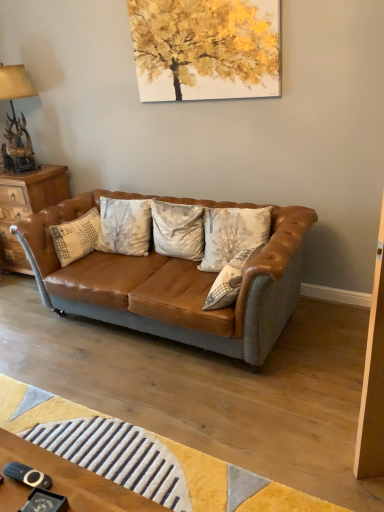
Question: Is point (216, 282) closer or farther from the camera than point (97, 237)?

Choices:
 (A) closer
 (B) farther

Answer: (A)

Question: From a real-world perspective, relative to white textured pillow at center, positioned as the 4th pillow in right-to-left order, is textured beige pillow at center, which is counted as the third pillow, starting from the left, vertically above or below?

Choices:
 (A) below
 (B) above

Answer: (A)

Question: Which object is positioned closest to the yellow woolen mat at lower center?

Choices:
 (A) textured beige pillow at center, the first pillow positioned from the right
 (B) textured beige pillow at center, the 2th pillow in the right-to-left sequence
 (C) leather couch at center
 (D) silky beige pillow at center, the third pillow when ordered from right to left
 (E) antler bronze lamp at upper left

Answer: (C)

Question: Which object is positioned closest to the textured beige pillow at center, marked as the 4th pillow in a left-to-right arrangement?

Choices:
 (A) antler bronze lamp at upper left
 (B) silky beige pillow at center, the third pillow when ordered from right to left
 (C) textured beige pillow at center, which is counted as the third pillow, starting from the left
 (D) white textured pillow at center, the first pillow when ordered from left to right
 (E) wooden nightstand at left

Answer: (B)